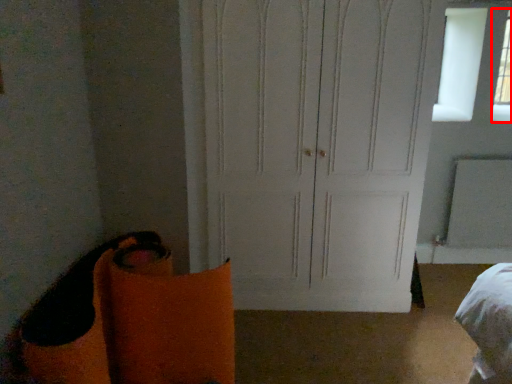
Question: Where is window (annotated by the red box) located in relation to door in the image?

Choices:
 (A) right
 (B) left

Answer: (A)